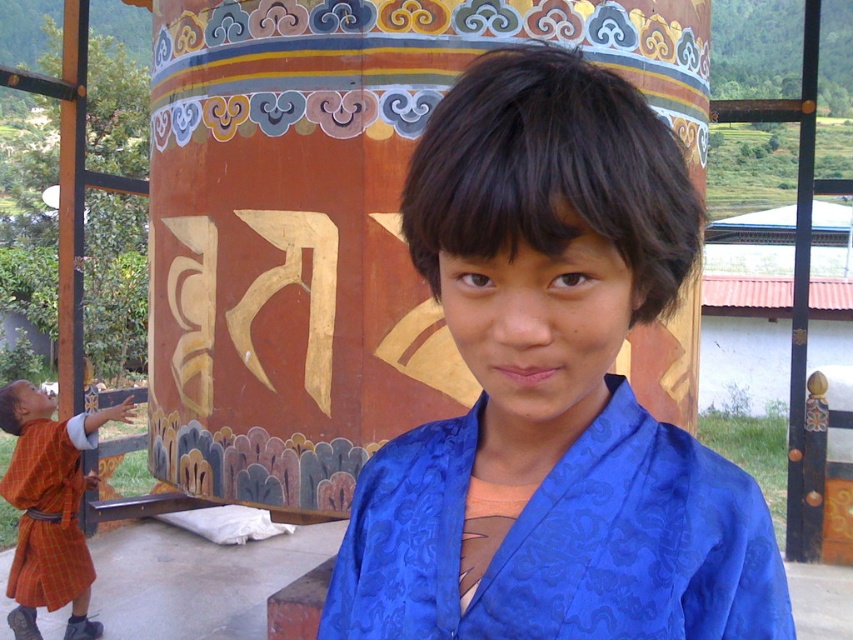
You are a photographer standing 1.20 meters away from the point marked at coordinates [634,440]. You want to capture a photo of the large golden symbol on the cylinder while ensuring the boy in the traditional blue garment is also in the frame. Can you fit both the golden symbol and the boy into your camera view without moving your position?

The point marked at coordinates [634,440] is 1.20 meters away from you. Since the golden symbol and the boy are both located near this point, your camera should be able to capture both in the frame without moving, provided the lens has an appropriate angle of view.

You are a photographer planning to take a picture of the blue silk kimono at center. The camera you are using has a focal length of 50mm. To ensure the entire kimono is in focus, what is the minimum distance you should maintain from the kimono based on its position coordinates?

The blue silk kimono at center is located at point coordinates of (552, 390). However, without additional information about the camera sensor size, depth of field settings, or the actual dimensions of the kimono, it is not possible to calculate the exact minimum distance required for the entire kimono to be in focus.

You are a photographer trying to capture both the blue satin robe at center and the orange plaid robe at lower left in a single frame. Based on their positions, which robe should you adjust your camera angle to focus on first to ensure both are visible?

The blue satin robe at center is positioned on the right side of orange plaid robe at lower left, so you should focus on the orange plaid robe at lower left first to ensure both are within the frame.